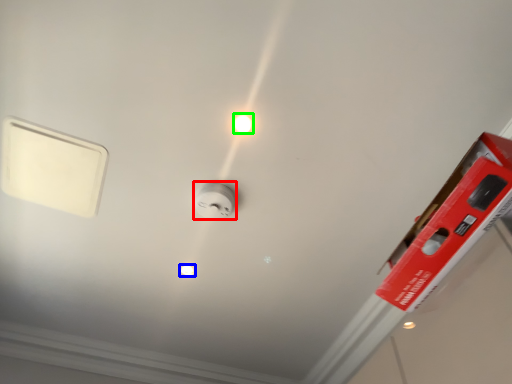
Question: Based on their relative distances, which object is nearer to power plugs and sockets (highlighted by a red box)? Choose from light bulb (highlighted by a blue box) and light bulb (highlighted by a green box).

Choices:
 (A) light bulb
 (B) light bulb

Answer: (B)